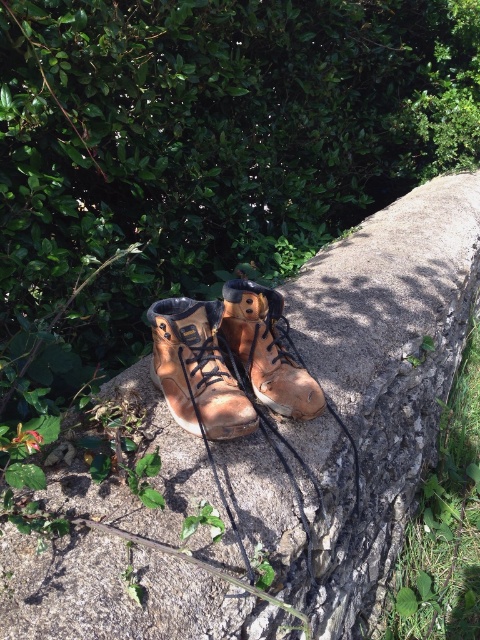
Who is positioned more to the left, rusty concrete wall at center or brown leather boot at center?

brown leather boot at center is more to the left.

Is point (68, 488) less distant than point (235, 310)?

Yes, it is in front of point (235, 310).

Identify the location of rusty concrete wall at center. The width and height of the screenshot is (480, 640). (363, 396).

Identify the location of rusty concrete wall at center. This screenshot has height=640, width=480. (363, 396).

Can you confirm if leather boot at center is bigger than brown leather boot at center?

Yes, leather boot at center is bigger than brown leather boot at center.

Does leather boot at center appear on the left side of brown leather boot at center?

Correct, you'll find leather boot at center to the left of brown leather boot at center.

Is point (237, 397) closer to viewer compared to point (220, 324)?

That is True.

Identify the location of leather boot at center. Image resolution: width=480 pixels, height=640 pixels. (196, 369).

Which is in front, point (108, 536) or point (199, 429)?

Point (108, 536) is in front.

In the scene shown: Can you confirm if rusty concrete wall at center is taller than leather boot at center?

Yes, rusty concrete wall at center is taller than leather boot at center.

Where is `rusty concrete wall at center`? rusty concrete wall at center is located at coordinates (363, 396).